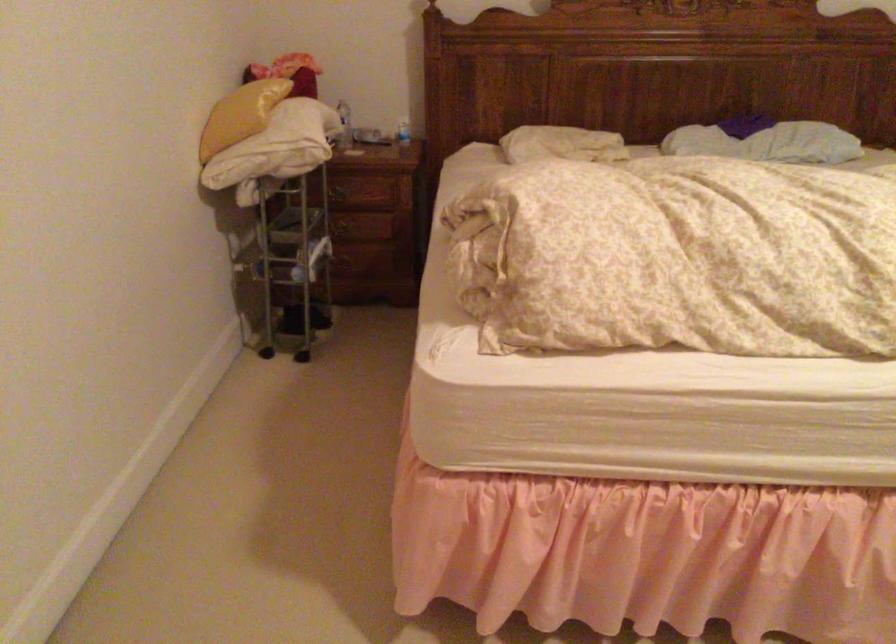
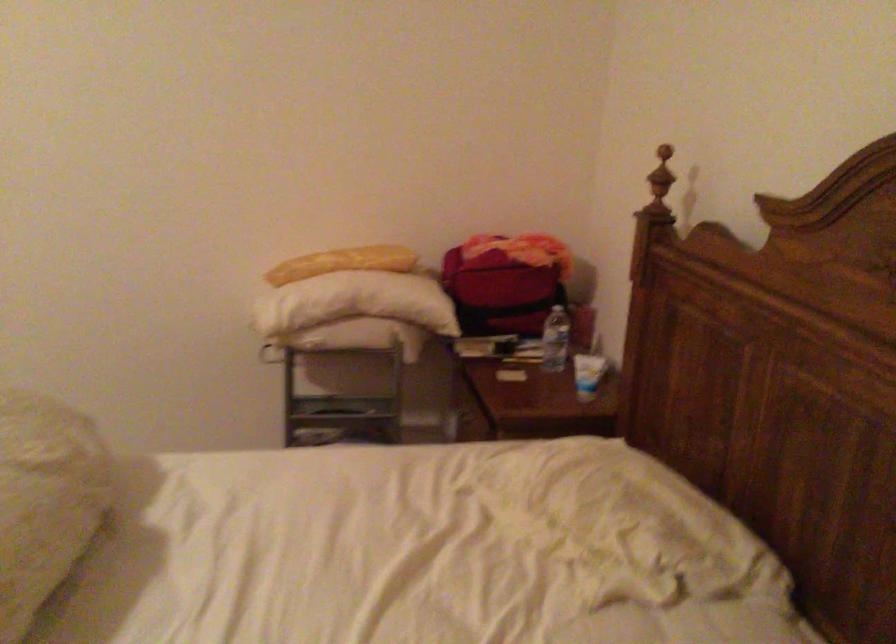
The point at (268, 102) is marked in the first image. Where is the corresponding point in the second image?

(342, 263)